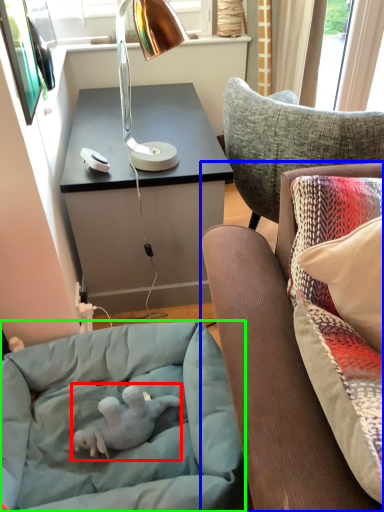
Question: Estimate the real-world distances between objects in this image. Which object is farther from baby elephant (highlighted by a red box), studio couch (highlighted by a blue box) or dog bed (highlighted by a green box)?

Choices:
 (A) studio couch
 (B) dog bed

Answer: (A)